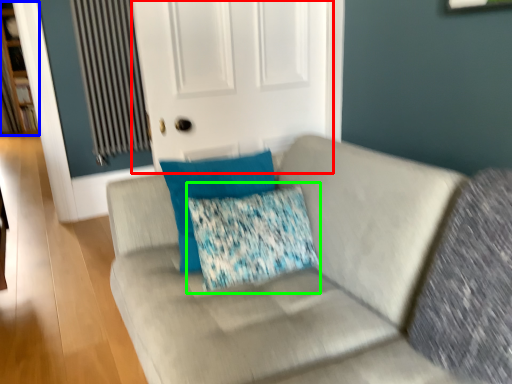
Question: Which object is positioned closest to screen door (highlighted by a red box)? Select from bookshelf (highlighted by a blue box) and throw pillow (highlighted by a green box).

Choices:
 (A) bookshelf
 (B) throw pillow

Answer: (B)